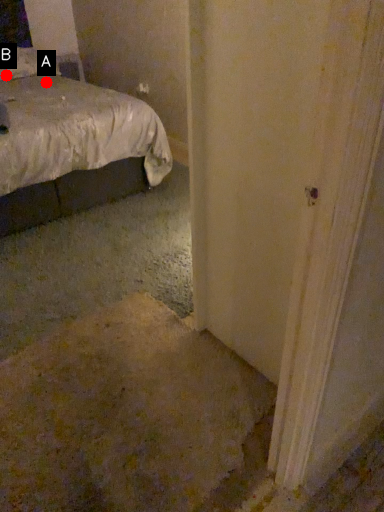
Question: Two points are circled on the image, labeled by A and B beside each circle. Which point is farther from the camera taking this photo?

Choices:
 (A) A is further
 (B) B is further

Answer: (A)